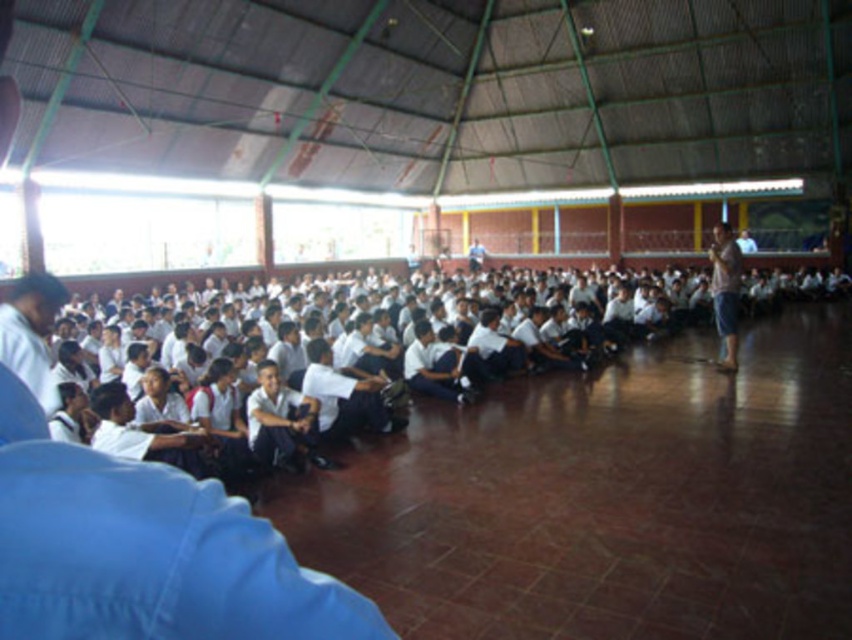
Question: Does blue fabric shirt at left have a smaller size compared to light brown wooden podium at right?

Choices:
 (A) yes
 (B) no

Answer: (A)

Question: Which point appears farthest from the camera in this image?

Choices:
 (A) (29, 340)
 (B) (735, 289)

Answer: (B)

Question: Does blue fabric shirt at left appear on the left side of light brown wooden podium at right?

Choices:
 (A) yes
 (B) no

Answer: (A)

Question: Is blue fabric shirt at left thinner than light brown wooden podium at right?

Choices:
 (A) no
 (B) yes

Answer: (B)